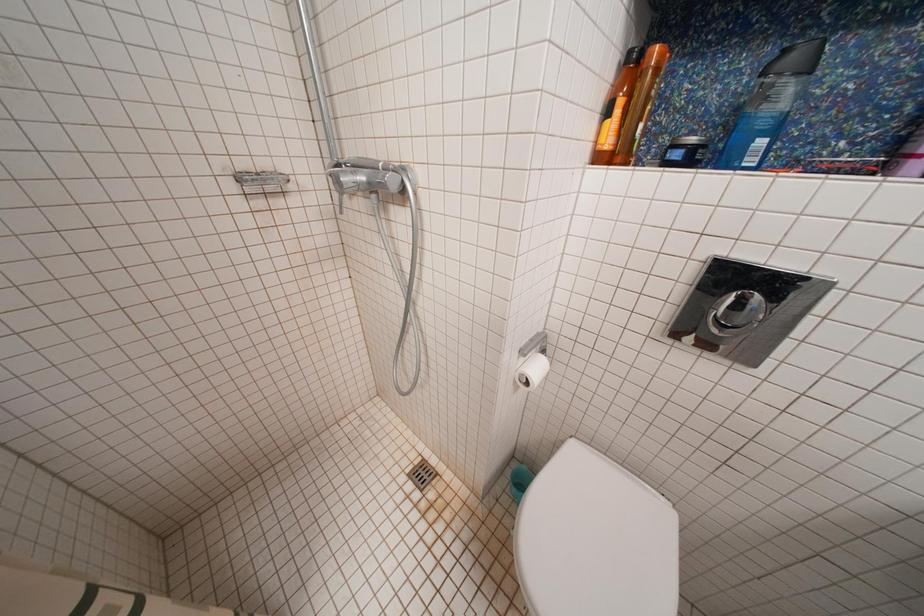
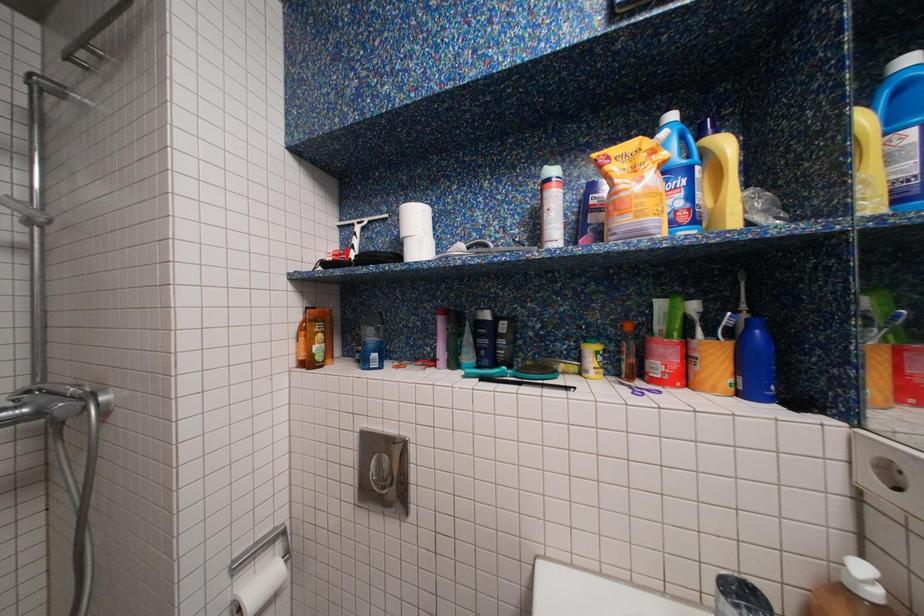
The images are taken continuously from a first-person perspective. In which direction is your viewpoint rotating?

The rotation direction of the camera is right-up.